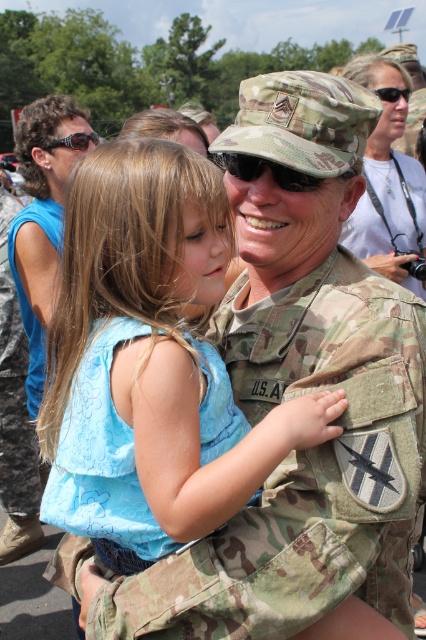
You are a photographer at the event and want to capture a closeup of the soldier and girl while ensuring both the black matte goggles at center and shiny brown goggles at upper left are visible in the frame. Which goggles should you position closer to the edge of the frame to include both?

Since the black matte goggles at center are to the right of the shiny brown goggles at upper left, you should position the shiny brown goggles at upper left closer to the edge of the frame to include both in the shot.

You are a photographer at the event and need to ensure both the matte white shirt at upper center and the blue fabric shirt at left are visible in the photo. Given their heights, which shirt should you focus on first to ensure it doesn

The matte white shirt at upper center is shorter than the blue fabric shirt at left, so you should focus on the blue fabric shirt at left first to ensure it is fully visible in the photo.

You are a photographer at the event and want to capture a closeup shot of both the matte white shirt at upper center and the shiny brown goggles at upper left. Given their sizes, which object should you zoom in more on to ensure both are clearly visible in the frame?

The matte white shirt at upper center is larger than the shiny brown goggles at upper left, so you should zoom in more on the matte white shirt at upper center to ensure both are clearly visible in the frame.